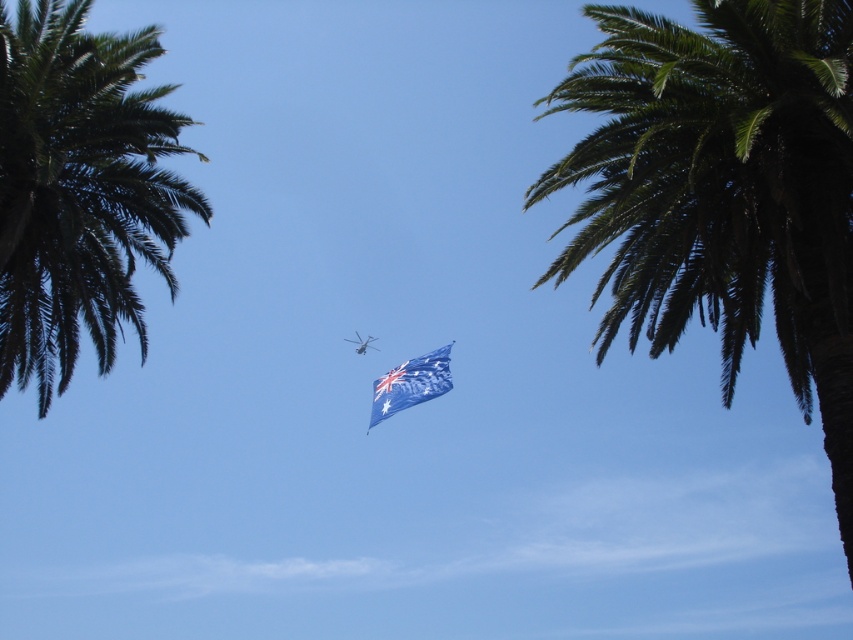
You are a pilot flying the metallic silver helicopter at center. You need to land it safely between the green leafy palm tree at left and another object. Based on the scene description, which object is closer to the helicopter for a safe landing?

The green leafy palm tree at left is closer to the metallic silver helicopter at center because it is positioned in front of the helicopter, indicating it is nearer in the scene.

You are a drone operator trying to fly a drone between the green leafy palm tree at left and the metallic silver helicopter at center. Based on the scene, can you estimate if the space between them is wide enough for your drone?

The green leafy palm tree at left might be wider than metallic silver helicopter at center, so the space between them may not be wide enough for the drone to pass safely.